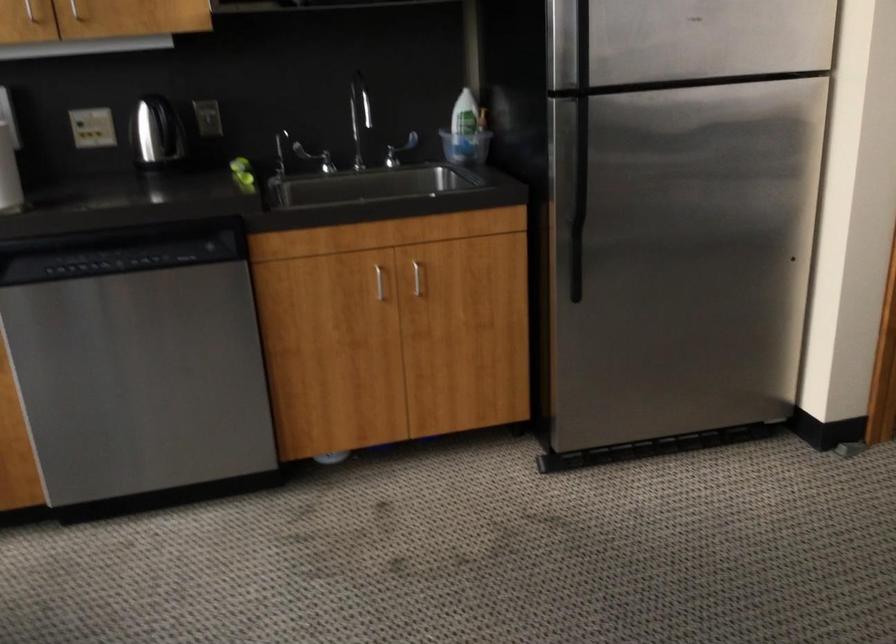
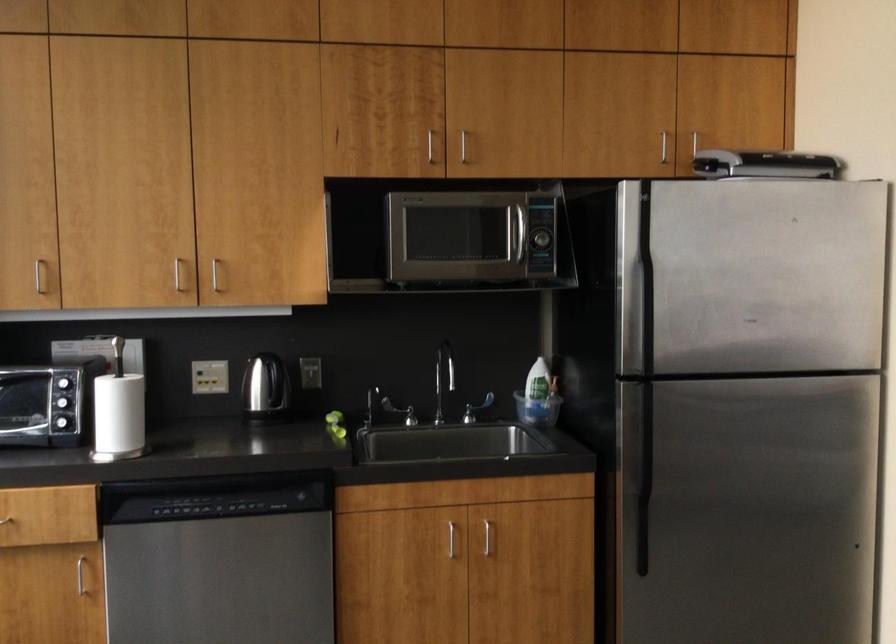
The point at (462, 126) is marked in the first image. Where is the corresponding point in the second image?

(539, 391)